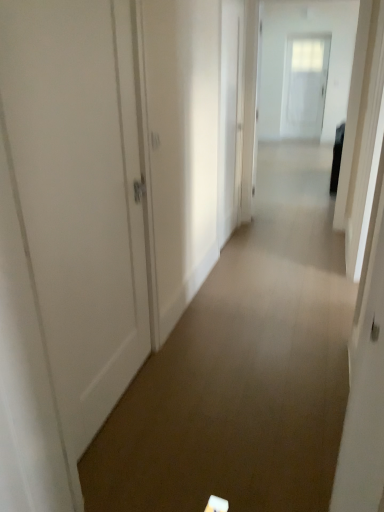
Question: Is white glossy door at upper center, the first door viewed from the back, thinner than white glossy door at upper center?

Choices:
 (A) no
 (B) yes

Answer: (A)

Question: From a real-world perspective, is white glossy door at upper center, positioned as the third door in bottom-to-top order, on top of white glossy door at upper center?

Choices:
 (A) yes
 (B) no

Answer: (A)

Question: Does white glossy door at upper center, positioned as the third door in bottom-to-top order, have a greater width compared to white glossy door at upper center?

Choices:
 (A) yes
 (B) no

Answer: (A)

Question: Could white glossy door at upper center be considered to be inside white glossy door at upper center, marked as the 1th door in a right-to-left arrangement?

Choices:
 (A) no
 (B) yes

Answer: (A)

Question: Is white glossy door at upper center, positioned as the third door in bottom-to-top order, smaller than white glossy door at upper center?

Choices:
 (A) yes
 (B) no

Answer: (B)

Question: Looking at their shapes, would you say white glossy door at upper center, arranged as the third door when viewed from the front, is wider or thinner than white matte door at left, which ranks as the first door in bottom-to-top order?

Choices:
 (A) wide
 (B) thin

Answer: (A)

Question: From a real-world perspective, relative to white matte door at left, which ranks as the first door in bottom-to-top order, is white glossy door at upper center, the first door viewed from the back, vertically above or below?

Choices:
 (A) below
 (B) above

Answer: (B)

Question: Is white glossy door at upper center, arranged as the third door when viewed from the front, bigger or smaller than white matte door at left, arranged as the 3th door when viewed from the back?

Choices:
 (A) big
 (B) small

Answer: (A)

Question: Is white glossy door at upper center, the 1th door from the top, taller or shorter than white matte door at left, which ranks as the 1th door in left-to-right order?

Choices:
 (A) tall
 (B) short

Answer: (A)

Question: From a real-world perspective, is white glossy door at upper center above or below white glossy door at center, marked as the second door in a top-to-bottom arrangement?

Choices:
 (A) above
 (B) below

Answer: (B)

Question: In terms of height, does white glossy door at upper center look taller or shorter compared to white glossy door at center, which is the 2th door in bottom-to-top order?

Choices:
 (A) tall
 (B) short

Answer: (A)

Question: Is white glossy door at upper center bigger or smaller than white glossy door at center, which ranks as the 2th door in left-to-right order?

Choices:
 (A) big
 (B) small

Answer: (A)

Question: In the image, is white glossy door at upper center positioned in front of or behind white glossy door at center, the 2th door viewed from the front?

Choices:
 (A) front
 (B) behind

Answer: (B)

Question: In terms of height, does white glossy door at center, placed as the second door when sorted from back to front, look taller or shorter compared to white glossy door at upper center, positioned as the third door in bottom-to-top order?

Choices:
 (A) tall
 (B) short

Answer: (B)

Question: Would you say white glossy door at center, marked as the second door in a top-to-bottom arrangement, is to the left or to the right of white glossy door at upper center, the 1th door from the top, in the picture?

Choices:
 (A) right
 (B) left

Answer: (B)